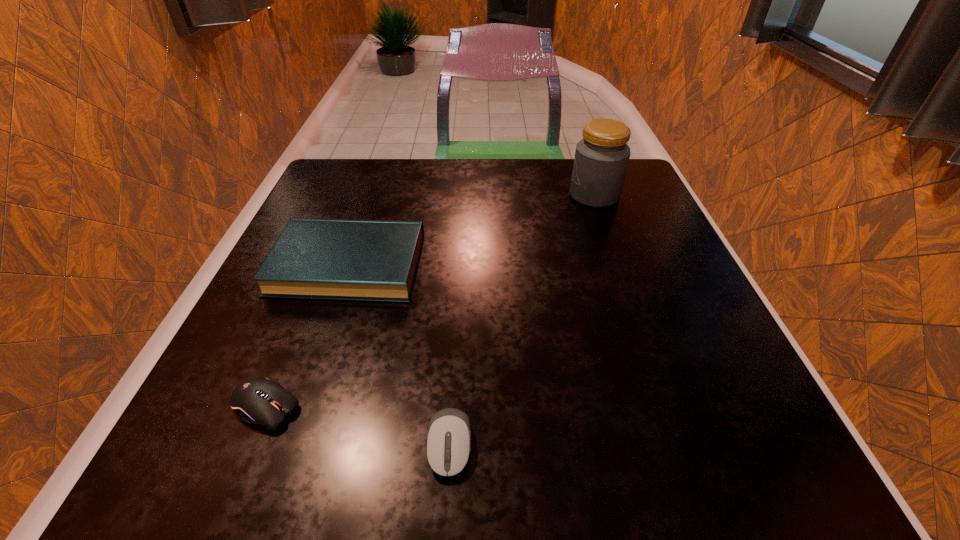
The width and height of the screenshot is (960, 540). I want to click on empty space between the left computer equipment and the third object from left to right, so click(x=358, y=426).

At what (x,y) coordinates should I click in order to perform the action: click on vacant point located between the right computer equipment and the second farthest object. Please return your answer as a coordinate pair (x, y). Image resolution: width=960 pixels, height=540 pixels. Looking at the image, I should click on (399, 355).

This screenshot has height=540, width=960. Find the location of `free space between the second object from right to left and the second farthest object`. free space between the second object from right to left and the second farthest object is located at coordinates (399, 355).

This screenshot has height=540, width=960. I want to click on object that stands as the third closest to the rightmost object, so 258,400.

I want to click on object that stands as the closest to the right computer equipment, so click(x=258, y=400).

This screenshot has height=540, width=960. I want to click on vacant region that satisfies the following two spatial constraints: 1. on the surface of the farthest object near the warning symbol; 2. on the wheel side of the third object from left to right, so click(684, 445).

The width and height of the screenshot is (960, 540). Find the location of `blank space that satisfies the following two spatial constraints: 1. on the back side of the left computer equipment; 2. on the left side of the third nearest object`. blank space that satisfies the following two spatial constraints: 1. on the back side of the left computer equipment; 2. on the left side of the third nearest object is located at coordinates (324, 265).